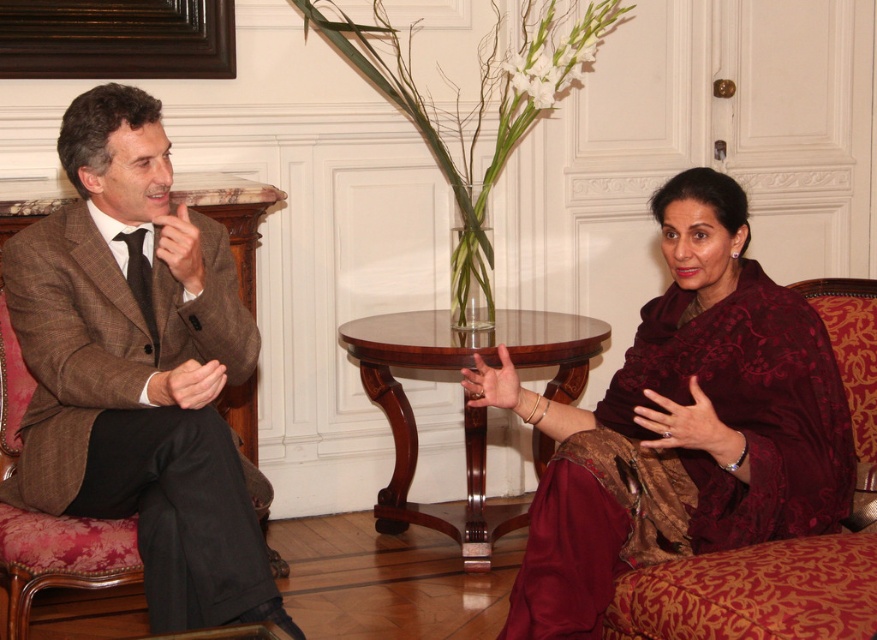
Is point (369, 362) closer to camera compared to point (182, 371)?

No, it is behind (182, 371).

Who is taller, mahogany wood round table at center or matte brown hand at center?

mahogany wood round table at center is taller.

Which is behind, point (590, 346) or point (214, 392)?

Positioned behind is point (590, 346).

Locate an element on the screen. The width and height of the screenshot is (877, 640). mahogany wood round table at center is located at coordinates (462, 404).

The image size is (877, 640). What do you see at coordinates (136, 372) in the screenshot? I see `brown textured suit at left` at bounding box center [136, 372].

Is brown textured suit at left bigger than burgundy velvet robe at right?

Yes.

Is point (51, 512) farther from camera compared to point (605, 538)?

Yes, it is behind point (605, 538).

At what (x,y) coordinates should I click in order to perform the action: click on brown textured suit at left. Please return your answer as a coordinate pair (x, y). This screenshot has height=640, width=877. Looking at the image, I should click on (136, 372).

Who is shorter, maroon fabric hand at center or matte brown hand at center?

Standing shorter between the two is matte brown hand at center.

Does maroon fabric hand at center have a larger size compared to matte brown hand at center?

Correct, maroon fabric hand at center is larger in size than matte brown hand at center.

At what (x,y) coordinates should I click in order to perform the action: click on maroon fabric hand at center. Please return your answer as a coordinate pair (x, y). Looking at the image, I should click on (689, 426).